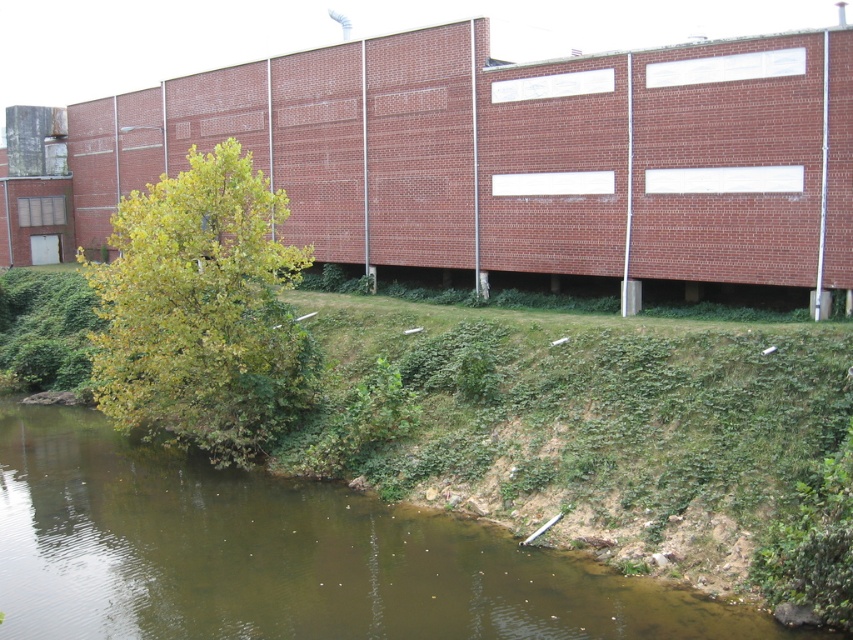
Question: In this image, where is green mossy river at lower left located relative to green leafy tree at lower left?

Choices:
 (A) above
 (B) below

Answer: (B)

Question: Can you confirm if green mossy river at lower left is wider than green leafy tree at lower left?

Choices:
 (A) no
 (B) yes

Answer: (A)

Question: Which object is closer to the camera taking this photo?

Choices:
 (A) green leafy tree at lower left
 (B) green mossy river at lower left

Answer: (B)

Question: Does green mossy river at lower left appear on the left side of green leafy tree at lower left?

Choices:
 (A) yes
 (B) no

Answer: (B)